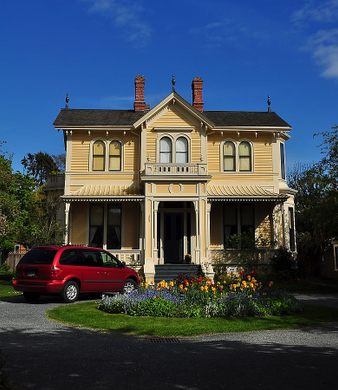
At what (x,y) coordinates should I click in order to perform the action: click on door. Please return your answer as a coordinate pair (x, y). Looking at the image, I should click on (173, 246).